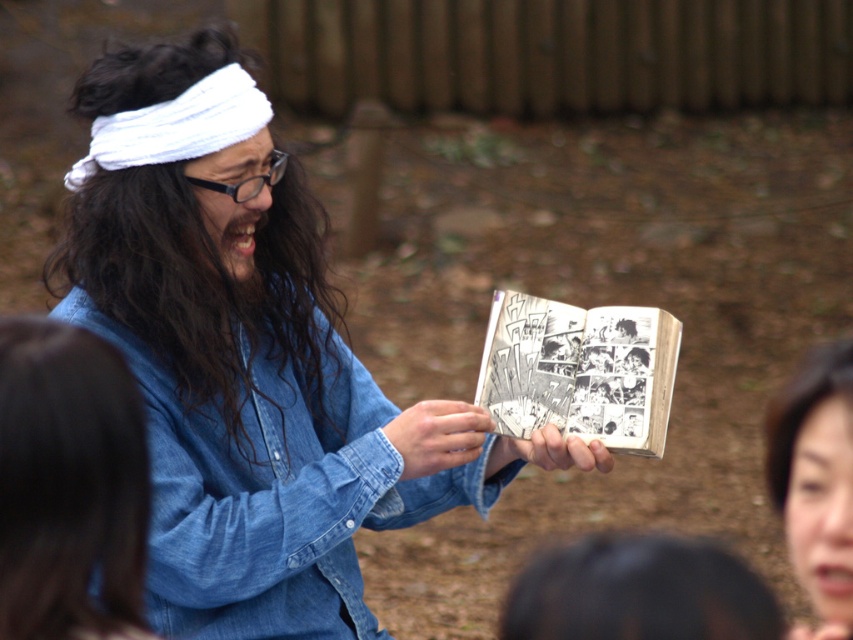
Can you confirm if dark brown wavy hair at center is smaller than black paper comic book at center?

No, dark brown wavy hair at center is not smaller than black paper comic book at center.

Between dark brown wavy hair at center and black paper comic book at center, which one is positioned lower?

black paper comic book at center is lower down.

Is point (123, 264) closer to viewer compared to point (660, 444)?

No, it is behind (660, 444).

The image size is (853, 640). I want to click on dark brown wavy hair at center, so click(204, 285).

Locate an element on the screen. dark brown wavy hair at center is located at coordinates (204, 285).

Can you confirm if dark brown wavy hair at center is wider than smooth brown hair at lower right?

Yes, dark brown wavy hair at center is wider than smooth brown hair at lower right.

Is point (299, 289) closer to camera compared to point (821, 356)?

That is True.

What are the coordinates of `dark brown wavy hair at center` in the screenshot? It's located at (204, 285).

Based on the photo, who is higher up, denim jacket at center or black paper comic book at center?

black paper comic book at center is above.

Image resolution: width=853 pixels, height=640 pixels. What do you see at coordinates (273, 492) in the screenshot?
I see `denim jacket at center` at bounding box center [273, 492].

Is point (170, 520) positioned before point (624, 374)?

Yes, point (170, 520) is in front of point (624, 374).

Locate an element on the screen. denim jacket at center is located at coordinates (273, 492).